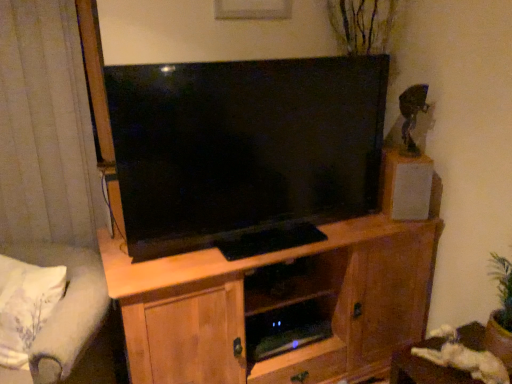
The height and width of the screenshot is (384, 512). What do you see at coordinates (276, 305) in the screenshot?
I see `light brown wood cabinet at center` at bounding box center [276, 305].

The image size is (512, 384). I want to click on light gray fabric studio couch at lower left, so click(68, 320).

Looking at this image, which of these two, light gray fabric studio couch at lower left or gray fabric curtain at left, is thinner?

gray fabric curtain at left.

Which is further, (47, 354) or (33, 44)?

Point (33, 44)

Identify the location of curtain behind the light gray fabric studio couch at lower left. This screenshot has height=384, width=512. (46, 128).

From the image's perspective, which is below, light gray fabric studio couch at lower left or gray fabric curtain at left?

From the image's view, light gray fabric studio couch at lower left is below.

What are the coordinates of `cabinetry that appears below the gray fabric curtain at left (from a real-world perspective)` in the screenshot? It's located at (276, 305).

In the scene shown: Considering the relative positions of light brown wood cabinet at center and gray fabric curtain at left in the image provided, is light brown wood cabinet at center to the left of gray fabric curtain at left from the viewer's perspective?

Incorrect, light brown wood cabinet at center is not on the left side of gray fabric curtain at left.

Is light brown wood cabinet at center taller or shorter than gray fabric curtain at left?

light brown wood cabinet at center is shorter than gray fabric curtain at left.

From the image's perspective, does light brown wood cabinet at center appear lower than gray fabric curtain at left?

Yes, from the image's perspective, light brown wood cabinet at center is beneath gray fabric curtain at left.

Is wooden table at lower right looking in the opposite direction of white matte speaker at upper right?

No, wooden table at lower right is not facing away from white matte speaker at upper right.

Can white matte speaker at upper right be found inside wooden table at lower right?

No, white matte speaker at upper right is not a part of wooden table at lower right.

Considering the relative sizes of wooden table at lower right and white matte speaker at upper right in the image provided, is wooden table at lower right thinner than white matte speaker at upper right?

Incorrect, the width of wooden table at lower right is not less than that of white matte speaker at upper right.

From the image's perspective, is wooden table at lower right above white matte speaker at upper right?

Actually, wooden table at lower right appears below white matte speaker at upper right in the image.

Is gray fabric curtain at left inside white matte speaker at upper right?

No, gray fabric curtain at left is located outside of white matte speaker at upper right.

Is white matte speaker at upper right taller or shorter than gray fabric curtain at left?

In the image, white matte speaker at upper right appears to be shorter than gray fabric curtain at left.

Is white matte speaker at upper right turned away from gray fabric curtain at left?

No, gray fabric curtain at left is not at the back of white matte speaker at upper right.

From the picture: Is white matte speaker at upper right bigger than gray fabric curtain at left?

No.

Based on the photo, is light gray fabric studio couch at lower left in contact with light brown wood cabinet at center?

There is a gap between light gray fabric studio couch at lower left and light brown wood cabinet at center.

From a real-world perspective, between light gray fabric studio couch at lower left and light brown wood cabinet at center, who is vertically higher?

light gray fabric studio couch at lower left, from a real-world perspective.

Looking at this image, is light gray fabric studio couch at lower left looking in the opposite direction of light brown wood cabinet at center?

No, light gray fabric studio couch at lower left is not facing the opposite direction of light brown wood cabinet at center.

Does wooden table at lower right contain light gray fabric studio couch at lower left?

No, light gray fabric studio couch at lower left is not surrounded by wooden table at lower right.

From the picture: Which of these two, wooden table at lower right or light gray fabric studio couch at lower left, stands taller?

Standing taller between the two is light gray fabric studio couch at lower left.

In the scene shown: Which is closer to the camera, [402,367] or [89,279]?

Point [89,279]

From the image's perspective, which is above, gray fabric curtain at left or wooden table at lower right?

gray fabric curtain at left appears higher in the image.

Is gray fabric curtain at left situated inside wooden table at lower right or outside?

gray fabric curtain at left lies outside wooden table at lower right.

What's the angular difference between gray fabric curtain at left and wooden table at lower right's facing directions?

The angle between the facing direction of gray fabric curtain at left and the facing direction of wooden table at lower right is 88.1 degrees.

Is gray fabric curtain at left aimed at wooden table at lower right?

No, gray fabric curtain at left is not aimed at wooden table at lower right.

The image size is (512, 384). Identify the location of studio couch that appears below the gray fabric curtain at left (from the image's perspective). (68, 320).

The image size is (512, 384). In order to click on cabinetry below the gray fabric curtain at left (from a real-world perspective) in this screenshot , I will do `click(276, 305)`.

When comparing their distances from gray fabric curtain at left, does light brown wood cabinet at center or white matte speaker at upper right seem further?

The object further to gray fabric curtain at left is white matte speaker at upper right.

From the image, which object appears to be farther from light brown wood cabinet at center, light gray fabric studio couch at lower left or wooden table at lower right?

light gray fabric studio couch at lower left.

Looking at the image, which one is located closer to wooden table at lower right, white matte speaker at upper right or light brown wood cabinet at center?

light brown wood cabinet at center.

Which object lies further to the anchor point wooden table at lower right, gray fabric curtain at left or light gray fabric studio couch at lower left?

gray fabric curtain at left.

When comparing their distances from white matte speaker at upper right, does light gray fabric studio couch at lower left or wooden table at lower right seem closer?

wooden table at lower right is positioned closer to the anchor white matte speaker at upper right.

From the image, which object appears to be nearer to light brown wood cabinet at center, wooden table at lower right or light gray fabric studio couch at lower left?

Among the two, wooden table at lower right is located nearer to light brown wood cabinet at center.

When comparing their distances from light gray fabric studio couch at lower left, does white matte speaker at upper right or gray fabric curtain at left seem closer?

The object closer to light gray fabric studio couch at lower left is gray fabric curtain at left.

Estimate the real-world distances between objects in this image. Which object is further from light gray fabric studio couch at lower left, light brown wood cabinet at center or wooden table at lower right?

The object further to light gray fabric studio couch at lower left is wooden table at lower right.

Where is `studio couch located between gray fabric curtain at left and light brown wood cabinet at center in the left-right direction`? The height and width of the screenshot is (384, 512). studio couch located between gray fabric curtain at left and light brown wood cabinet at center in the left-right direction is located at coordinates (68, 320).

Where is `studio couch situated between gray fabric curtain at left and wooden table at lower right from left to right`? studio couch situated between gray fabric curtain at left and wooden table at lower right from left to right is located at coordinates (68, 320).

At what (x,y) coordinates should I click in order to perform the action: click on cabinetry between gray fabric curtain at left and white matte speaker at upper right. Please return your answer as a coordinate pair (x, y). This screenshot has height=384, width=512. Looking at the image, I should click on (276, 305).

Find the location of a particular element. This screenshot has height=384, width=512. loudspeaker between gray fabric curtain at left and wooden table at lower right from left to right is located at coordinates pos(406,185).